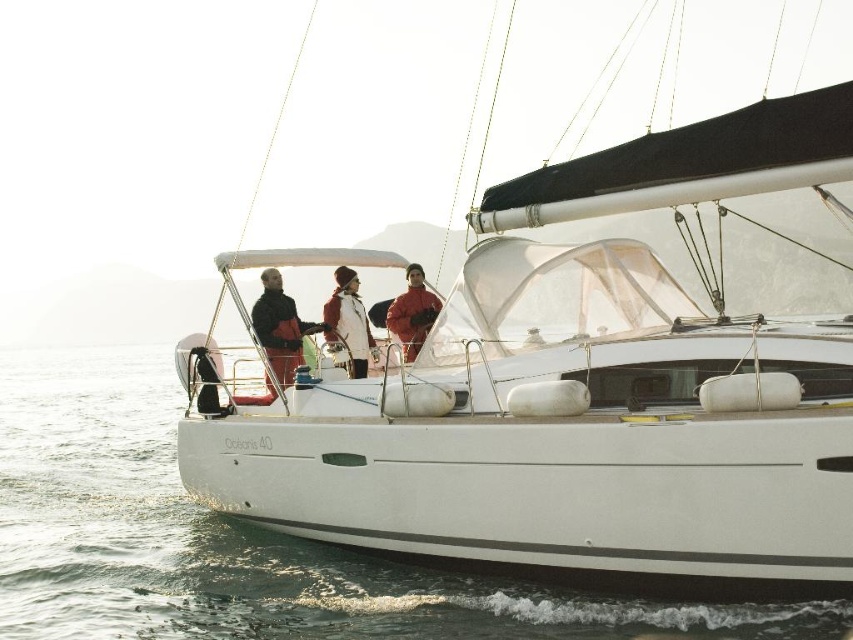
You are navigating the sailboat named Oceaneis 40 and need to avoid an obstacle. The clear water at lower left is located at point 0.845, 0.285. Where should you steer the boat to navigate safely?

The clear water at lower left is located at point (242, 540), so you should steer the boat towards the clear water at lower left to navigate safely.

Consider the image. You are a sailor on the Oce?nis 40 and want to check the water below the boat. From your position on the white matte sailboat at center, which direction should you look to see the clear water at lower left?

You should look downward and toward the lower left from the white matte sailboat at center to see the clear water at lower left since the sailboat is positioned in front of it.

You are a sailor on the Oce anis 40 and need to secure the boat to a dock. The dock has a mooring ring located at the lower left corner. Given the white matte sailboat at center and the clear water at lower left, which object is closer to the mooring ring and why?

The clear water at lower left is closer to the mooring ring located at the lower left corner because it is positioned at the same location as the mooring ring, whereas the white matte sailboat at center is further away from that area.